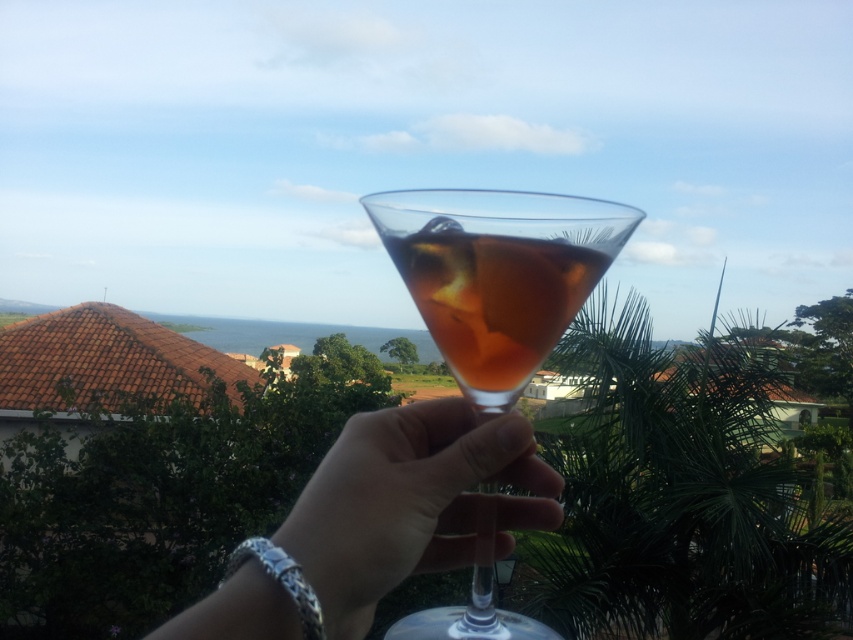
Between translucent glass cocktail at center and translucent glass drink at center, which one has more height?

translucent glass cocktail at center

Who is more distant from viewer, (524, 369) or (471, 314)?

Positioned behind is point (524, 369).

Where is `translucent glass cocktail at center`? The width and height of the screenshot is (853, 640). translucent glass cocktail at center is located at coordinates (497, 275).

Describe the element at coordinates (497, 275) in the screenshot. I see `translucent glass cocktail at center` at that location.

Can you confirm if translucent glass cocktail at center is wider than clear glass at center?

In fact, translucent glass cocktail at center might be narrower than clear glass at center.

Who is more distant from viewer, (x=502, y=230) or (x=428, y=524)?

Point (x=428, y=524)

Where is `translucent glass cocktail at center`? translucent glass cocktail at center is located at coordinates (497, 275).

Does clear glass at center have a larger size compared to translucent glass drink at center?

Indeed, clear glass at center has a larger size compared to translucent glass drink at center.

Can you confirm if clear glass at center is thinner than translucent glass drink at center?

In fact, clear glass at center might be wider than translucent glass drink at center.

What do you see at coordinates (410, 502) in the screenshot? I see `clear glass at center` at bounding box center [410, 502].

Locate an element on the screen. The image size is (853, 640). clear glass at center is located at coordinates [410, 502].